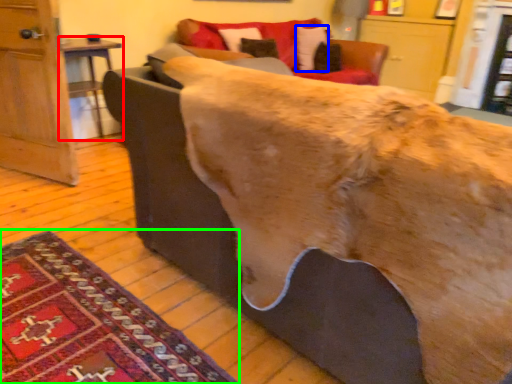
Question: Which is nearer to the table (highlighted by a red box)? pillow (highlighted by a blue box) or mat (highlighted by a green box).

Choices:
 (A) pillow
 (B) mat

Answer: (A)